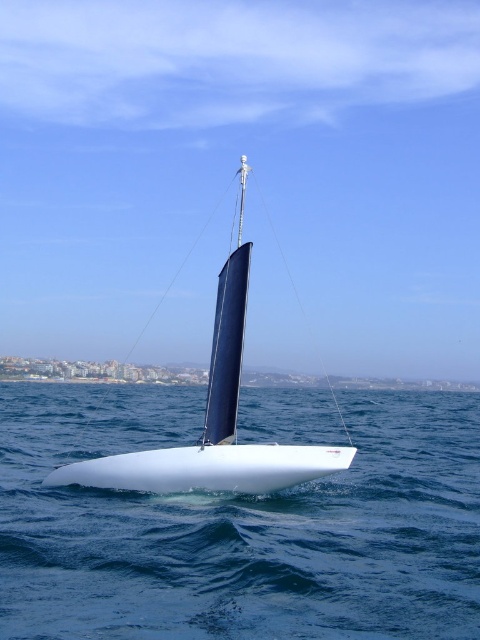
You are standing on the deck of the sailboat and want to know how far the point at coordinates point (x=446, y=538) is from you. Can you determine the distance?

The point (x=446, y=538) is 33.07 feet away from the camera, so the distance from you on the deck is approximately 33.07 feet.

You are standing on the deck of the sailboat and looking towards the distant shoreline. There are two points marked on the sailboat deck at coordinates point (182, 586) and point (47, 477). Which point is closer to you when facing the shoreline?

Point (182, 586) is in front of point (47, 477), so when facing the shoreline, point (182, 586) is closer to you.